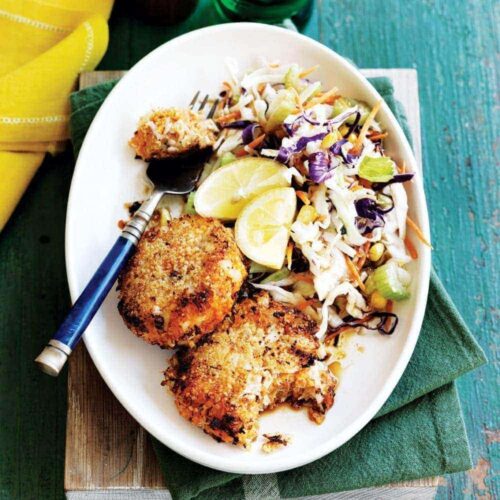
At what (x,y) coordinates should I click in order to perform the action: click on cloth napkins. Please return your answer as a coordinate pair (x, y). The height and width of the screenshot is (500, 500). Looking at the image, I should click on (414, 386), (47, 84).